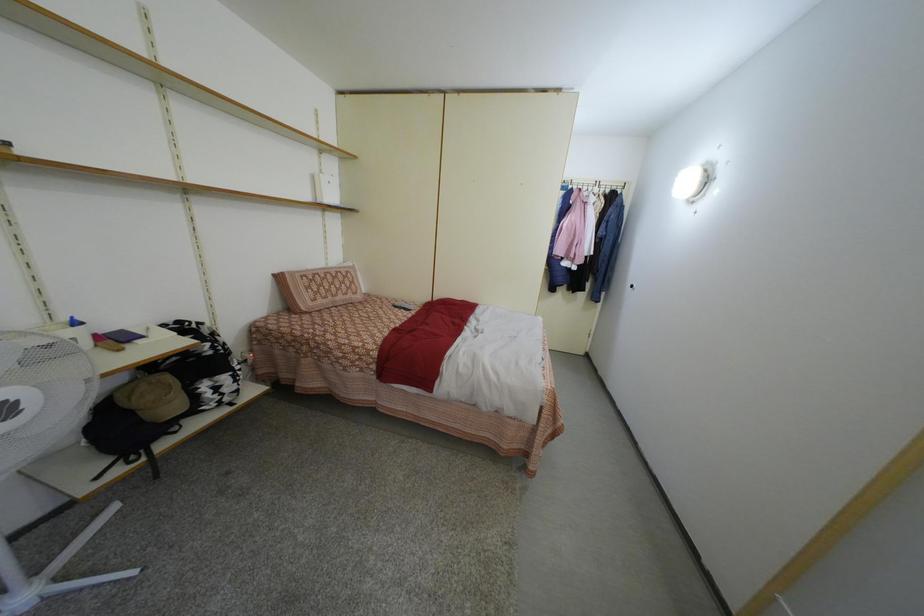
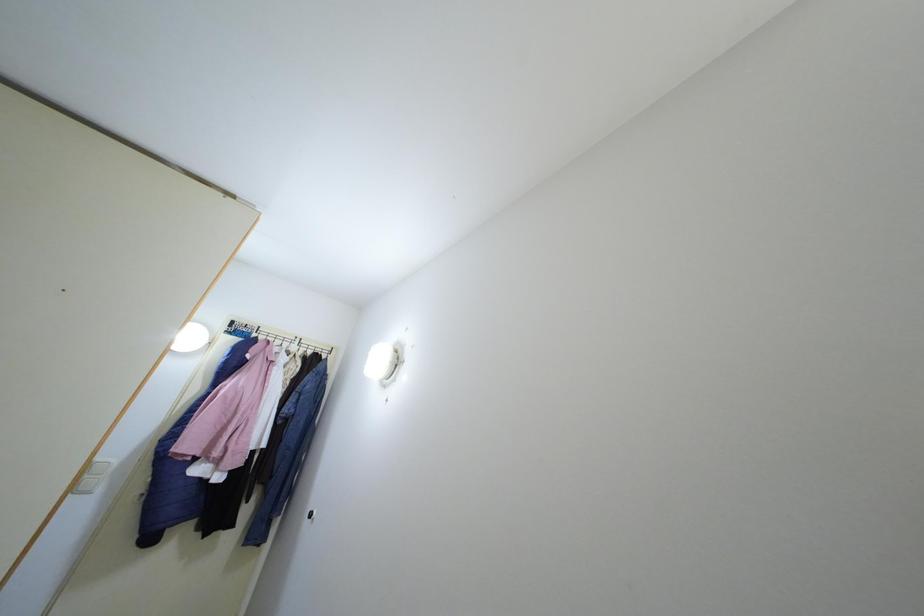
The first image is from the beginning of the video and the second image is from the end. How did the camera likely rotate when shooting the video?

The camera's rotation is toward right-up.